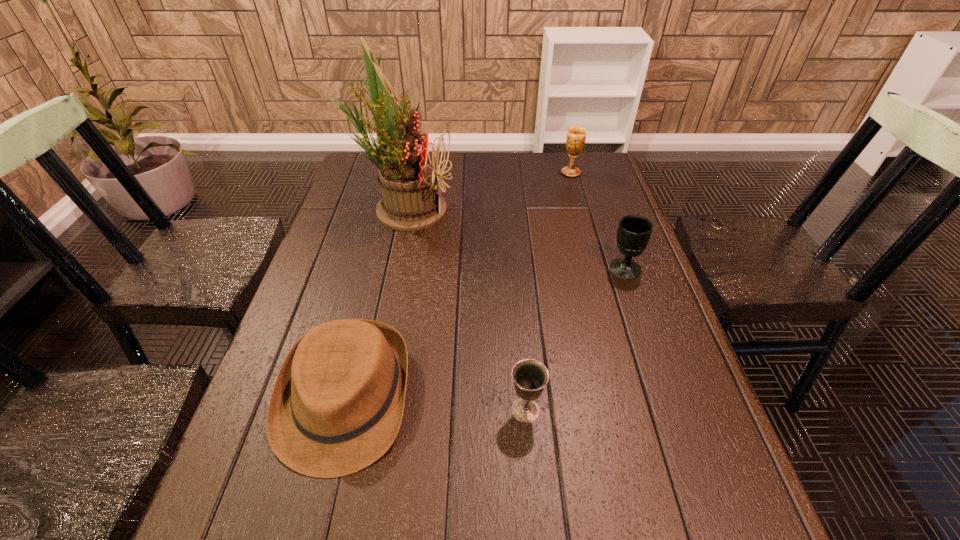
The height and width of the screenshot is (540, 960). In the image, there is a desktop. What are the coordinates of `vacant space at the far right corner` in the screenshot? It's located at (589, 156).

Where is `free area in between the third object from left to right and the tallest object`? The height and width of the screenshot is (540, 960). free area in between the third object from left to right and the tallest object is located at coordinates (465, 309).

Find the location of a particular element. This screenshot has height=540, width=960. unoccupied position between the flower arrangement and the third object from left to right is located at coordinates (465, 309).

I want to click on free space that is in between the second nearest chalice and the fedora, so click(x=485, y=333).

Locate an element on the screen. The width and height of the screenshot is (960, 540). free space between the farthest object and the leftmost chalice is located at coordinates (548, 292).

You are a GUI agent. You are given a task and a screenshot of the screen. Output one action in this format:
    pyautogui.click(x=<x>, y=<y>)
    Task: Click on the vacant area that lies between the farthest chalice and the flower arrangement
    The width and height of the screenshot is (960, 540).
    Given the screenshot: What is the action you would take?
    pyautogui.click(x=487, y=191)

Image resolution: width=960 pixels, height=540 pixels. What are the coordinates of `empty space that is in between the nearest chalice and the second nearest chalice` in the screenshot? It's located at (575, 340).

Find the location of a particular element. unoccupied area between the second farthest object and the nearest chalice is located at coordinates (465, 309).

This screenshot has width=960, height=540. In order to click on unoccupied position between the fourth nearest object and the farthest chalice in this screenshot , I will do click(x=487, y=191).

You are a GUI agent. You are given a task and a screenshot of the screen. Output one action in this format:
    pyautogui.click(x=<x>, y=<y>)
    Task: Click on the vacant space that's between the leftmost chalice and the farthest chalice
    The width and height of the screenshot is (960, 540).
    Given the screenshot: What is the action you would take?
    pyautogui.click(x=548, y=292)